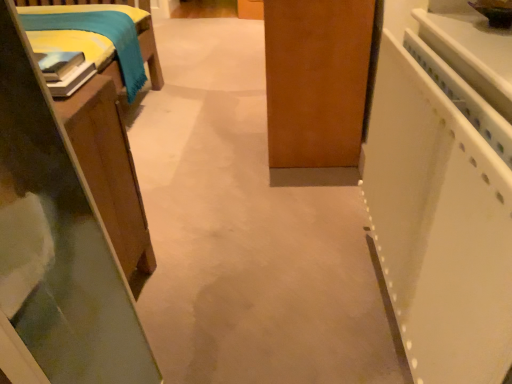
Question: Visually, is white plastic cabinet at right positioned to the left or to the right of wooden bed frame at left, the 1th furniture viewed from the top?

Choices:
 (A) right
 (B) left

Answer: (A)

Question: Is point (449, 306) closer or farther from the camera than point (160, 76)?

Choices:
 (A) farther
 (B) closer

Answer: (B)

Question: Estimate the real-world distances between objects in this image. Which object is farther from the white plastic cabinet at right?

Choices:
 (A) wooden table at left, which is counted as the 2th furniture, starting from the top
 (B) white glossy counter top at right
 (C) wooden bed frame at left, the 1th furniture viewed from the top

Answer: (C)

Question: Which is farther from the white glossy counter top at right?

Choices:
 (A) wooden table at left, which is counted as the 2th furniture, starting from the top
 (B) wooden bed frame at left, the second furniture from the bottom
 (C) white plastic cabinet at right

Answer: (B)